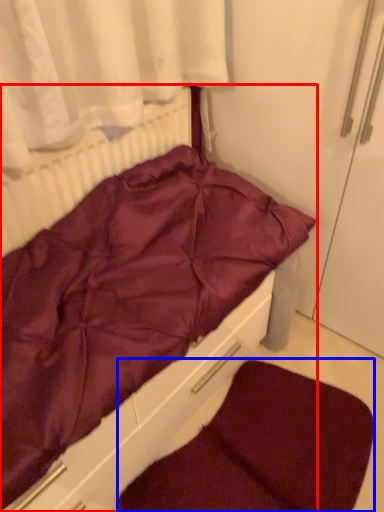
Question: Among these objects, which one is farthest to the camera, furniture (highlighted by a red box) or dog bed (highlighted by a blue box)?

Choices:
 (A) furniture
 (B) dog bed

Answer: (B)